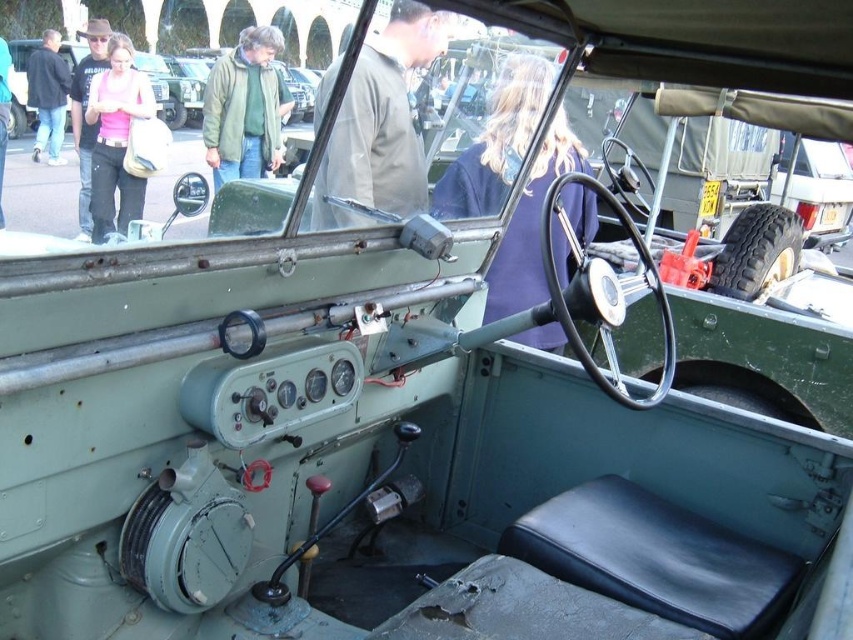
Does matte gray jacket at center have a greater width compared to light blue jeans at lower left?

Correct, the width of matte gray jacket at center exceeds that of light blue jeans at lower left.

Can you confirm if matte gray jacket at center is shorter than light blue jeans at lower left?

In fact, matte gray jacket at center may be taller than light blue jeans at lower left.

Is point (329, 186) behind point (0, 96)?

No, it is in front of (0, 96).

Identify the location of matte gray jacket at center. (380, 124).

Can you confirm if denim jacket at upper left is taller than light blue jeans at lower left?

Yes, denim jacket at upper left is taller than light blue jeans at lower left.

Measure the distance between denim jacket at upper left and light blue jeans at lower left.

They are 35.80 inches apart.

Between point (38, 72) and point (4, 54), which one is positioned in front?

Point (38, 72) is in front.

This screenshot has width=853, height=640. I want to click on denim jacket at upper left, so click(48, 96).

Between point (450, 193) and point (303, 116), which one is positioned in front?

Positioned in front is point (450, 193).

Locate an element on the screen. blue fabric at center is located at coordinates (496, 141).